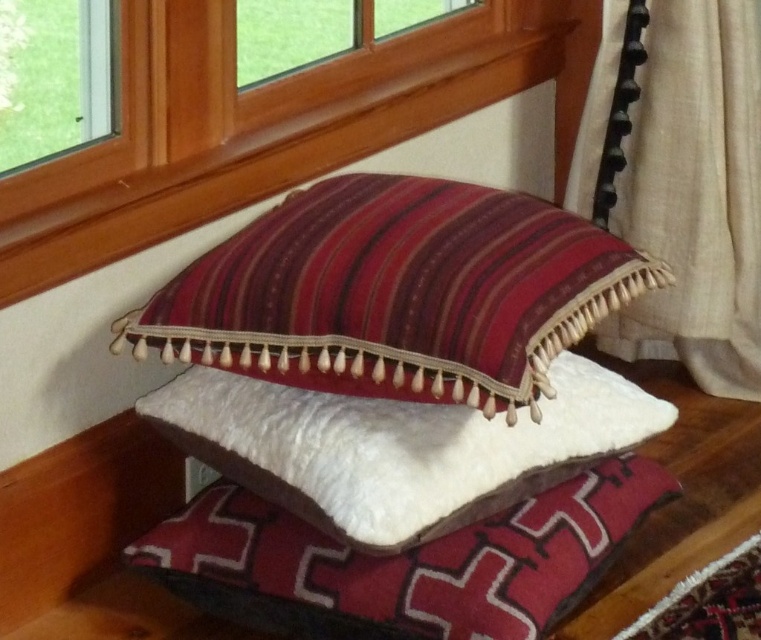
You are arranging a small vase that is 12 inches tall between the wooden frame at upper center and the white soft pillow at center. Can the vase fit between them without overlapping?

The distance between the wooden frame at upper center and the white soft pillow at center is 19.21 inches. Since the vase is only 12 inches tall, it can fit between them without overlapping.

You are arranging a display in the room and need to know the height relationship between the striped velvet cushion at center and the wooden frame at upper center. Which one is taller?

The striped velvet cushion at center has a lesser height compared to wooden frame at upper center, so the wooden frame at upper center is taller.

You are arranging flowers in the wooden frame at upper center and need to place them so they face the white soft pillow at center. Which side should you position the flowers to ensure they are visible from the pillow?

The wooden frame at upper center is on the left side of the white soft pillow at center, so you should position the flowers to face towards the right side of the wooden frame at upper center to ensure they are visible from the white soft pillow at center.